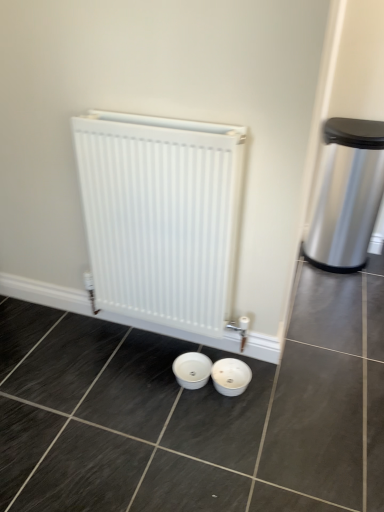
Where is `vacant region in front of polished stainless steel trash can at right`? This screenshot has width=384, height=512. vacant region in front of polished stainless steel trash can at right is located at coordinates (345, 290).